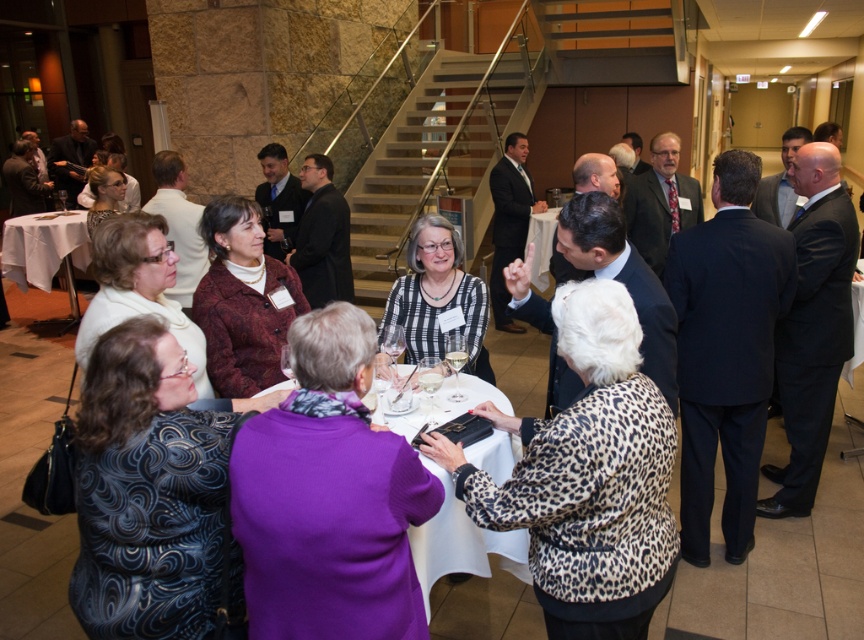
At what (x,y) coordinates should I click in order to perform the action: click on white cloth at center. Please return your answer as a coordinate pair (x, y). The image size is (864, 640). Looking at the image, I should click on (461, 544).

How distant is white cloth at center from white cloth table at lower left?

A distance of 5.30 meters exists between white cloth at center and white cloth table at lower left.

The height and width of the screenshot is (640, 864). I want to click on white cloth at center, so click(x=461, y=544).